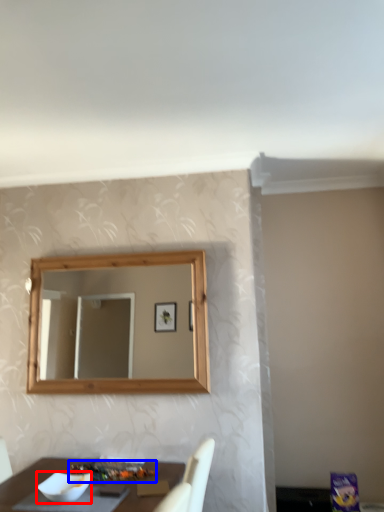
Question: Which point is further to the camera, bowl (highlighted by a red box) or food (highlighted by a blue box)?

Choices:
 (A) bowl
 (B) food

Answer: (B)